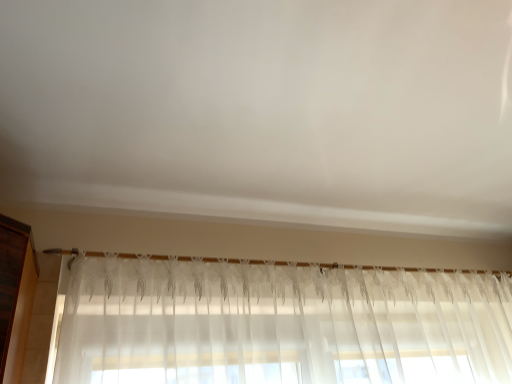
What is the approximate width of translucent white curtain at lower center?

The width of translucent white curtain at lower center is 5.04 inches.

This screenshot has width=512, height=384. What do you see at coordinates (280, 324) in the screenshot?
I see `translucent white curtain at lower center` at bounding box center [280, 324].

At what (x,y) coordinates should I click in order to perform the action: click on translucent white curtain at lower center. Please return your answer as a coordinate pair (x, y). Looking at the image, I should click on (280, 324).

Identify the location of translucent white curtain at lower center. (280, 324).